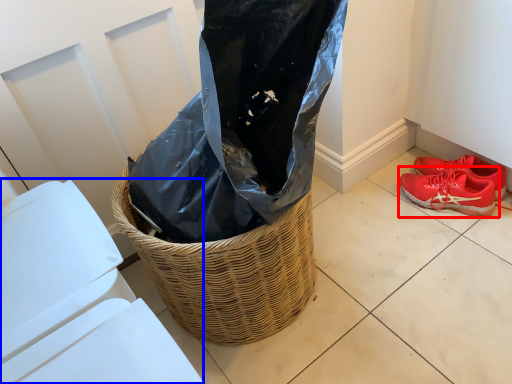
Question: Among these objects, which one is farthest to the camera, footwear (highlighted by a red box) or lift (highlighted by a blue box)?

Choices:
 (A) footwear
 (B) lift

Answer: (A)